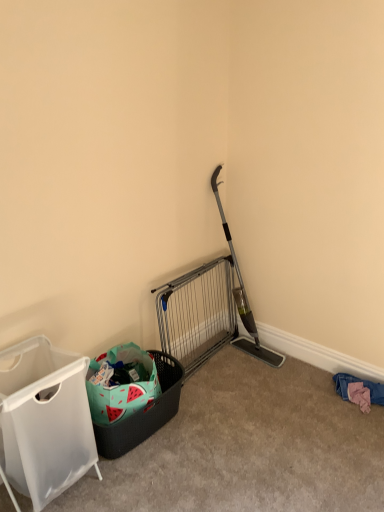
This screenshot has height=512, width=384. I want to click on white fabric laundry basket at left, so click(44, 421).

Image resolution: width=384 pixels, height=512 pixels. What are the coordinates of `pink fabric at lower right` in the screenshot? It's located at (363, 385).

From a real-world perspective, is pink fabric at lower right under watermelon-patterned plastic basket at lower left?

Yes, from a real-world perspective, pink fabric at lower right is under watermelon-patterned plastic basket at lower left.

Is pink fabric at lower right inside or outside of watermelon-patterned plastic basket at lower left?

pink fabric at lower right exists outside the volume of watermelon-patterned plastic basket at lower left.

Is watermelon-patterned plastic basket at lower left at the back of pink fabric at lower right?

No, pink fabric at lower right is not facing the opposite direction of watermelon-patterned plastic basket at lower left.

Is pink fabric at lower right positioned far away from watermelon-patterned plastic basket at lower left?

Absolutely, pink fabric at lower right is distant from watermelon-patterned plastic basket at lower left.

Who is smaller, watermelon-patterned plastic basket at lower left or silver metallic gate at center?

watermelon-patterned plastic basket at lower left is smaller.

Considering the points (126, 421) and (208, 316), which point is behind, point (126, 421) or point (208, 316)?

Positioned behind is point (208, 316).

How many degrees apart are the facing directions of watermelon-patterned plastic basket at lower left and silver metallic gate at center?

2.21 degrees separate the facing orientations of watermelon-patterned plastic basket at lower left and silver metallic gate at center.

Considering the sizes of objects watermelon-patterned plastic basket at lower left and silver metallic gate at center in the image provided, who is thinner, watermelon-patterned plastic basket at lower left or silver metallic gate at center?

silver metallic gate at center.

Is pink fabric at lower right completely or partially outside of silver metallic gate at center?

Yes, pink fabric at lower right is outside of silver metallic gate at center.

From a real-world perspective, relative to silver metallic gate at center, is pink fabric at lower right vertically above or below?

pink fabric at lower right is situated lower than silver metallic gate at center in the real world.

From the image's perspective, is pink fabric at lower right located above or below silver metallic gate at center?

pink fabric at lower right is below silver metallic gate at center.

From the picture: Is pink fabric at lower right placed right next to silver metallic gate at center?

No, pink fabric at lower right is not making contact with silver metallic gate at center.

Locate an element on the screen. This screenshot has width=384, height=512. waste container lying above the pink fabric at lower right (from the image's perspective) is located at coordinates (44, 421).

Is white fabric laundry basket at left located outside pink fabric at lower right?

Yes, white fabric laundry basket at left is not within pink fabric at lower right.

Which object is positioned more to the left, white fabric laundry basket at left or pink fabric at lower right?

white fabric laundry basket at left.

Can you confirm if silver metallic gate at center is taller than pink fabric at lower right?

Yes, silver metallic gate at center is taller than pink fabric at lower right.

Would you say silver metallic gate at center is inside or outside pink fabric at lower right?

silver metallic gate at center is outside pink fabric at lower right.

Locate an element on the screen. This screenshot has height=512, width=384. clothing below the silver metallic gate at center (from a real-world perspective) is located at coordinates (363, 385).

In the scene shown: How distant is silver metallic gate at center from pink fabric at lower right?

silver metallic gate at center is 38.69 inches from pink fabric at lower right.

From a real-world perspective, is pink fabric at lower right over white fabric laundry basket at left?

No, from a real-world perspective, pink fabric at lower right is not on top of white fabric laundry basket at left.

Is pink fabric at lower right positioned far away from white fabric laundry basket at left?

Yes, pink fabric at lower right is far from white fabric laundry basket at left.

Would you say pink fabric at lower right contains white fabric laundry basket at left?

That's incorrect, white fabric laundry basket at left is not inside pink fabric at lower right.

Between pink fabric at lower right and white fabric laundry basket at left, which one has larger width?

white fabric laundry basket at left.

Find the location of a particular element. Image resolution: width=384 pixels, height=512 pixels. shopping basket on the right of white fabric laundry basket at left is located at coordinates (144, 413).

Does point (9, 441) appear closer or farther from the camera than point (166, 398)?

Point (9, 441) appears to be closer to the viewer than point (166, 398).

Considering the positions of objects white fabric laundry basket at left and watermelon-patterned plastic basket at lower left in the image provided, who is more to the right, white fabric laundry basket at left or watermelon-patterned plastic basket at lower left?

watermelon-patterned plastic basket at lower left.

Is watermelon-patterned plastic basket at lower left at the back of white fabric laundry basket at left?

No, white fabric laundry basket at left is not facing away from watermelon-patterned plastic basket at lower left.

At what (x,y) coordinates should I click in order to perform the action: click on shopping basket on the left of pink fabric at lower right. Please return your answer as a coordinate pair (x, y). The height and width of the screenshot is (512, 384). Looking at the image, I should click on (144, 413).

Locate an element on the screen. The image size is (384, 512). shopping basket in front of the silver metallic gate at center is located at coordinates (144, 413).

In the scene shown: Which object lies further to the anchor point silver metallic gate at center, white fabric laundry basket at left or watermelon-patterned plastic basket at lower left?

The object further to silver metallic gate at center is white fabric laundry basket at left.

Looking at the image, which one is located further to silver metallic gate at center, watermelon-patterned plastic basket at lower left or pink fabric at lower right?

pink fabric at lower right is positioned further to the anchor silver metallic gate at center.

From the image, which object appears to be nearer to pink fabric at lower right, watermelon-patterned plastic basket at lower left or silver metallic gate at center?

silver metallic gate at center is closer to pink fabric at lower right.

Considering their positions, is white fabric laundry basket at left positioned further to watermelon-patterned plastic basket at lower left than pink fabric at lower right?

The object further to watermelon-patterned plastic basket at lower left is pink fabric at lower right.

Considering their positions, is silver metallic gate at center positioned further to pink fabric at lower right than watermelon-patterned plastic basket at lower left?

watermelon-patterned plastic basket at lower left.

Based on their spatial positions, is pink fabric at lower right or white fabric laundry basket at left closer to silver metallic gate at center?

Among the two, pink fabric at lower right is located nearer to silver metallic gate at center.

From the image, which object appears to be farther from white fabric laundry basket at left, silver metallic gate at center or pink fabric at lower right?

Based on the image, pink fabric at lower right appears to be further to white fabric laundry basket at left.

When comparing their distances from watermelon-patterned plastic basket at lower left, does silver metallic gate at center or pink fabric at lower right seem closer?

silver metallic gate at center.

Locate an element on the screen. shopping basket between white fabric laundry basket at left and pink fabric at lower right in the horizontal direction is located at coordinates 144,413.

This screenshot has height=512, width=384. I want to click on cage between watermelon-patterned plastic basket at lower left and pink fabric at lower right from left to right, so click(x=197, y=313).

The image size is (384, 512). I want to click on shopping basket between white fabric laundry basket at left and silver metallic gate at center along the z-axis, so click(x=144, y=413).

Where is `cage located between white fabric laundry basket at left and pink fabric at lower right in the left-right direction`? The width and height of the screenshot is (384, 512). cage located between white fabric laundry basket at left and pink fabric at lower right in the left-right direction is located at coordinates pos(197,313).